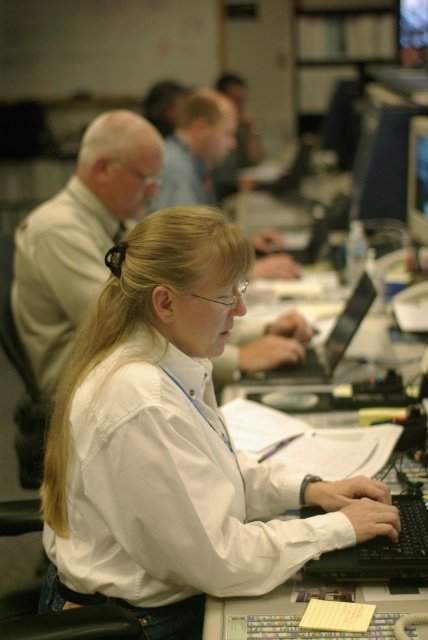
Question: Can you confirm if white plastic table at center is wider than matte black monitor at upper right?

Choices:
 (A) yes
 (B) no

Answer: (A)

Question: Can you confirm if black plastic laptop at center is positioned below matte black monitor at upper right?

Choices:
 (A) no
 (B) yes

Answer: (B)

Question: Which object is closer to the camera taking this photo?

Choices:
 (A) black plastic laptop at center
 (B) white plastic table at center

Answer: (B)

Question: Can you confirm if white plastic table at center is positioned above black plastic laptop at center?

Choices:
 (A) yes
 (B) no

Answer: (B)

Question: Based on their relative distances, which object is farther from the white plastic table at center?

Choices:
 (A) matte black monitor at upper right
 (B) black plastic laptop at center

Answer: (A)

Question: Based on their relative distances, which object is nearer to the matte black monitor at upper right?

Choices:
 (A) black plastic laptop at center
 (B) white plastic table at center

Answer: (A)